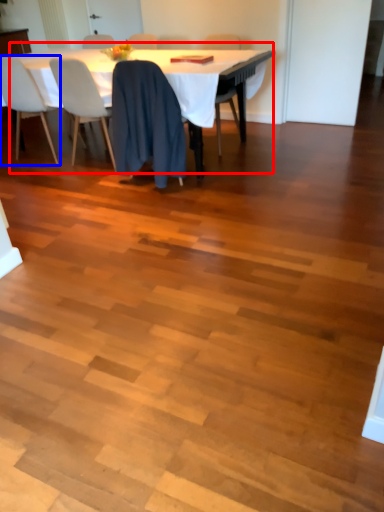
Question: Which object is closer to the camera taking this photo, table (highlighted by a red box) or chair (highlighted by a blue box)?

Choices:
 (A) table
 (B) chair

Answer: (A)